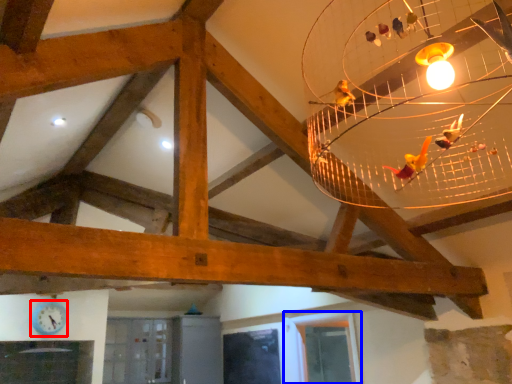
Question: Which object appears farthest to the camera in this image, clock (highlighted by a red box) or window (highlighted by a blue box)?

Choices:
 (A) clock
 (B) window

Answer: (A)